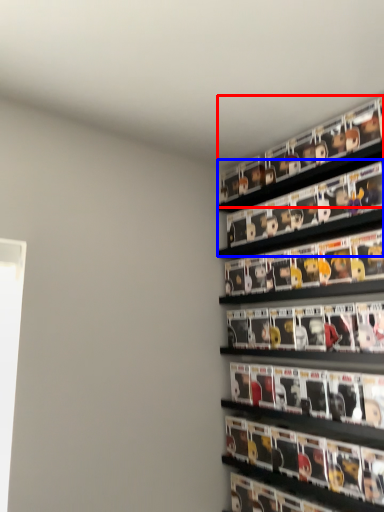
Question: Which point is further to the camera, shelf (highlighted by a red box) or shelf (highlighted by a blue box)?

Choices:
 (A) shelf
 (B) shelf

Answer: (A)